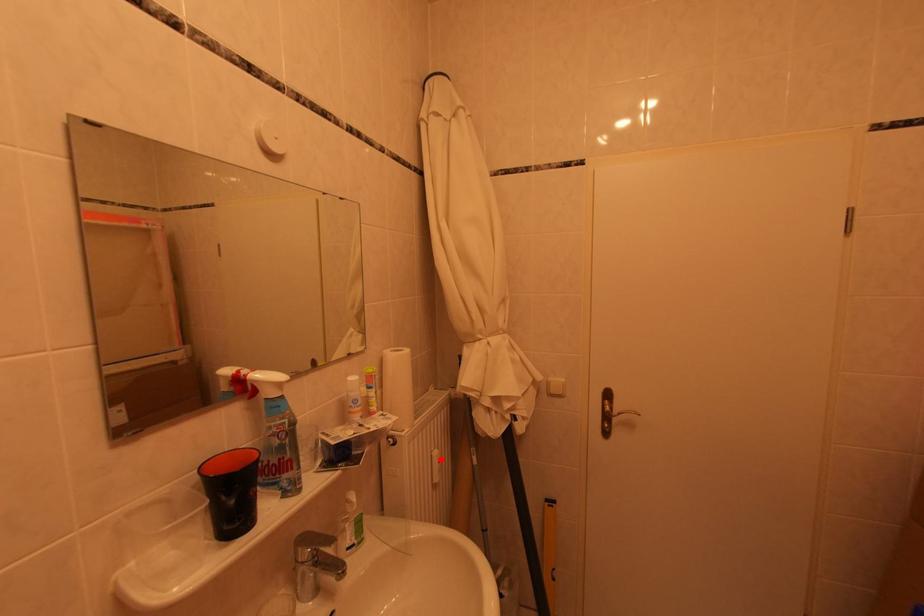
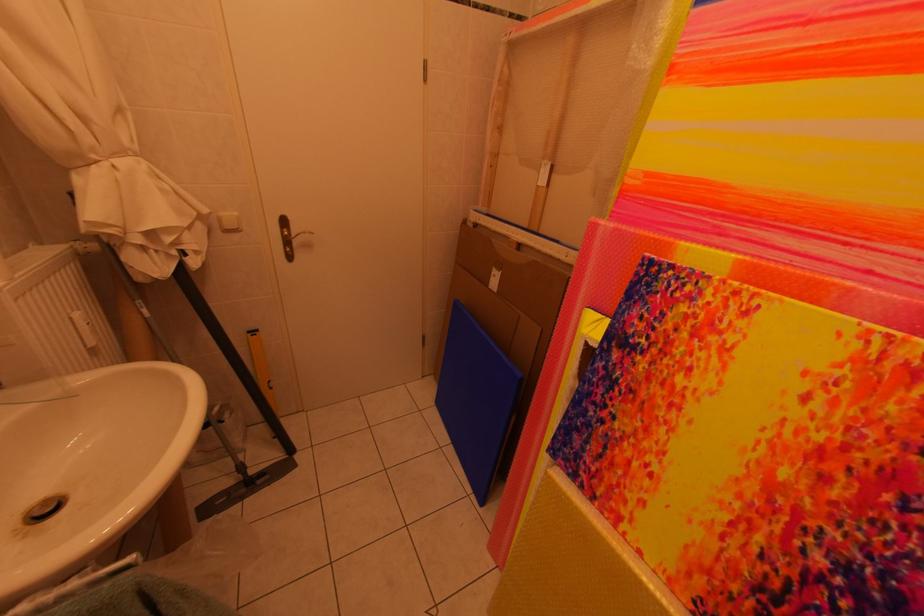
The point at the highlighted location is marked in the first image. Where is the corresponding point in the second image?

(79, 321)